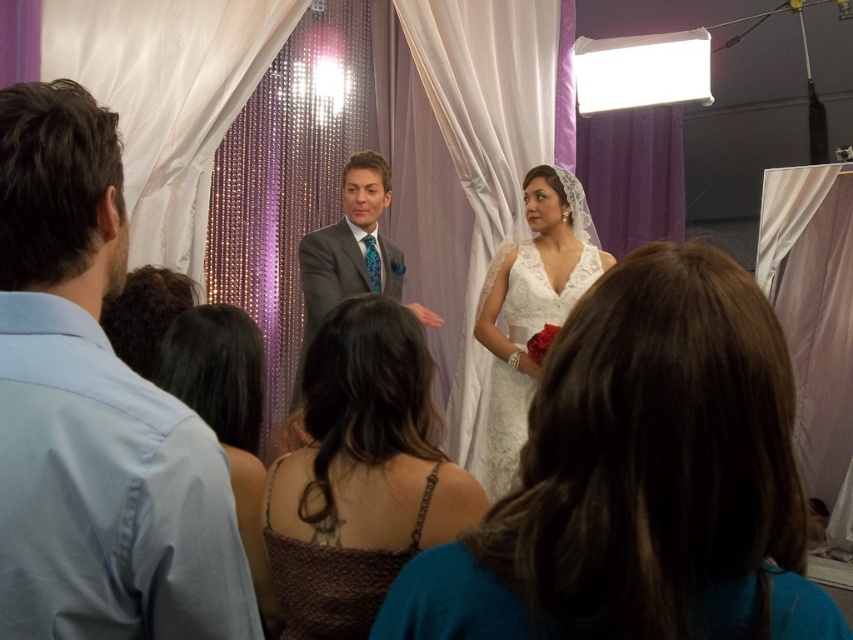
You are a photographer at the wedding. You need to capture a photo of the couple standing at the center. However, there are guests blocking the view. You see two points marked in the image. The first point is at coordinate point (x=755, y=609) and the second is at point (x=241, y=362). Which point is closer to the guests blocking the view so you can adjust your position accordingly?

Point (x=755, y=609) is in front of point (x=241, y=362), so the first point is closer to the guests blocking the view.

You are a photographer at a wedding and need to ensure both the white lace dress at center and brown textured dress at center are fully in frame. Given that your camera has a fixed width of 1.2 meters, will both dresses fit within the frame?

The white lace dress at center is wider than the brown textured dress at center. Since the camera frame is 1.2 meters wide, both dresses can fit as long as their combined width does not exceed the frame. However, the exact fit depends on their individual widths. The provided information only states the white lace dress is wider, but without specific measurements, we cannot confirm if both will fit entirely.